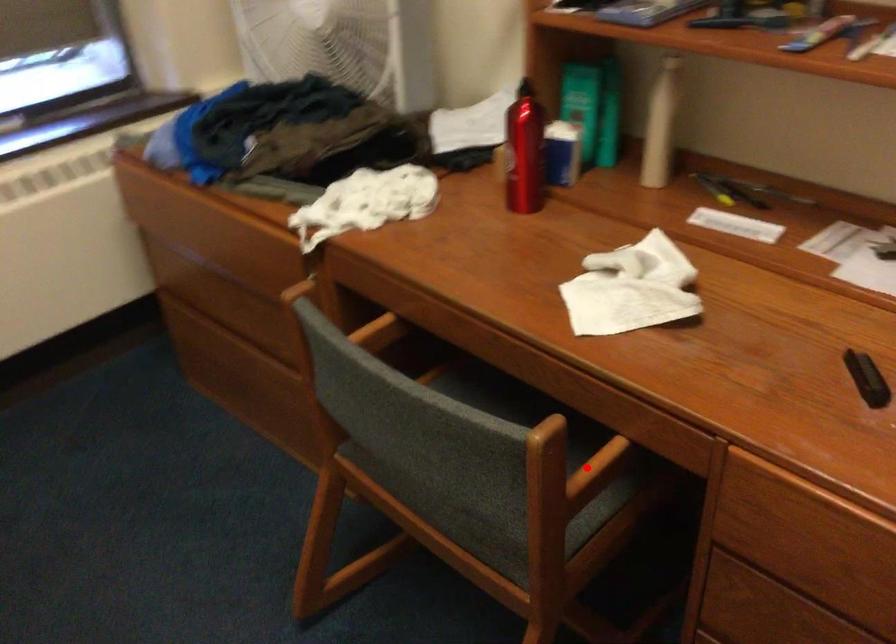
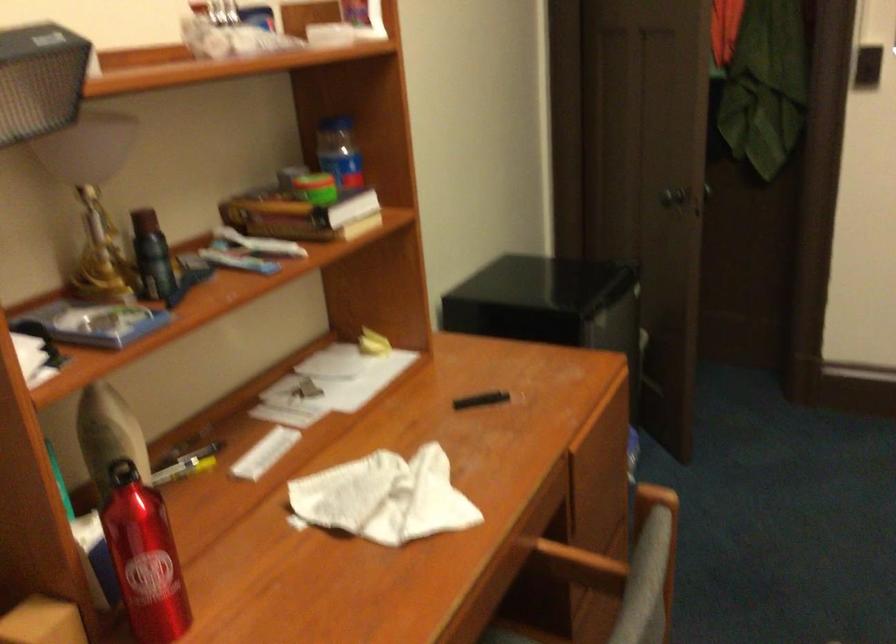
Question: I am providing you with two images of the same scene from different viewpoints. A red point is shown in image1. For the corresponding object point in image2, is it positioned nearer or farther from the camera?

Choices:
 (A) Nearer
 (B) Farther

Answer: (B)